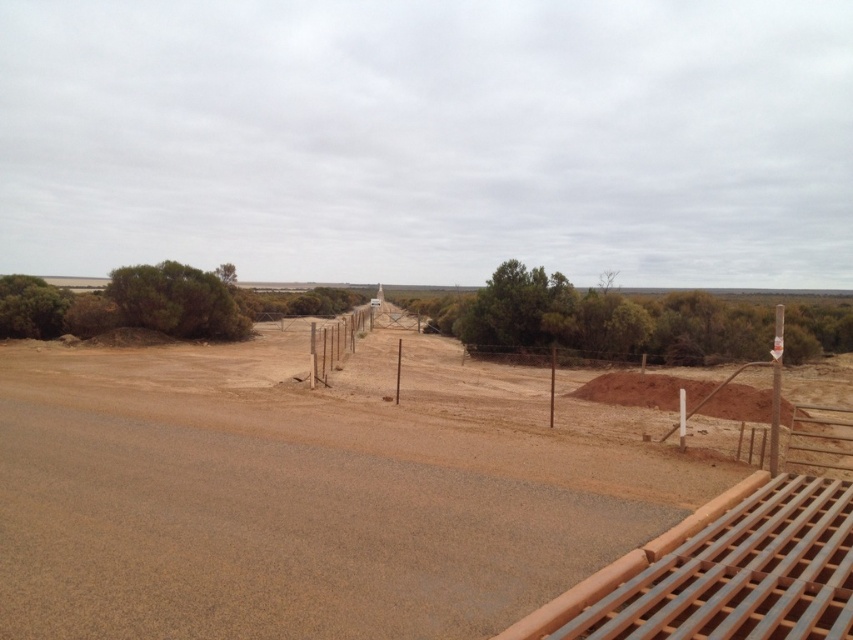
Question: Which point appears closest to the camera in this image?

Choices:
 (A) coord(514,493)
 (B) coord(624,394)

Answer: (A)

Question: Is brown sandy dirt field at center to the right of brown wire fence at center from the viewer's perspective?

Choices:
 (A) yes
 (B) no

Answer: (B)

Question: Does brown sandy dirt field at center have a smaller size compared to brown wire fence at center?

Choices:
 (A) no
 (B) yes

Answer: (B)

Question: Where is brown sandy dirt field at center located in relation to brown wire fence at center in the image?

Choices:
 (A) above
 (B) below

Answer: (B)

Question: Which object appears farthest from the camera in this image?

Choices:
 (A) brown wire fence at center
 (B) brown sandy dirt field at center

Answer: (A)

Question: Which object appears farthest from the camera in this image?

Choices:
 (A) brown wire fence at center
 (B) brown sandy dirt field at center

Answer: (A)